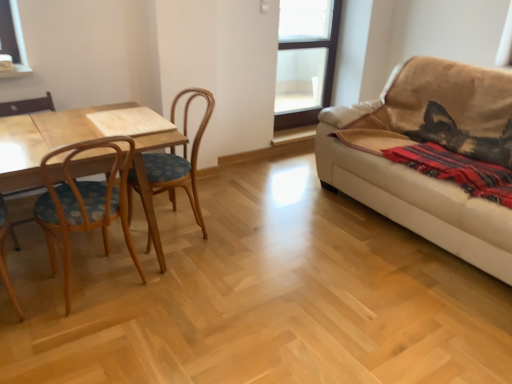
Question: Does beige fabric couch at right have a greater width compared to red woven blanket at right?

Choices:
 (A) no
 (B) yes

Answer: (B)

Question: Can you confirm if beige fabric couch at right is taller than red woven blanket at right?

Choices:
 (A) no
 (B) yes

Answer: (B)

Question: Is beige fabric couch at right not near red woven blanket at right?

Choices:
 (A) yes
 (B) no

Answer: (B)

Question: Is red woven blanket at right at the back of beige fabric couch at right?

Choices:
 (A) yes
 (B) no

Answer: (A)

Question: Is beige fabric couch at right to the left of red woven blanket at right from the viewer's perspective?

Choices:
 (A) no
 (B) yes

Answer: (A)

Question: From a real-world perspective, is beige fabric couch at right over red woven blanket at right?

Choices:
 (A) yes
 (B) no

Answer: (B)

Question: Is beige fabric couch at right at the left side of wooden table at left?

Choices:
 (A) yes
 (B) no

Answer: (B)

Question: Considering the relative sizes of beige fabric couch at right and wooden table at left in the image provided, is beige fabric couch at right thinner than wooden table at left?

Choices:
 (A) yes
 (B) no

Answer: (B)

Question: Is beige fabric couch at right facing away from wooden table at left?

Choices:
 (A) no
 (B) yes

Answer: (A)

Question: Is the position of beige fabric couch at right less distant than that of wooden table at left?

Choices:
 (A) no
 (B) yes

Answer: (A)

Question: From a real-world perspective, does beige fabric couch at right stand above wooden table at left?

Choices:
 (A) no
 (B) yes

Answer: (B)

Question: From a real-world perspective, does beige fabric couch at right sit lower than wooden table at left?

Choices:
 (A) yes
 (B) no

Answer: (B)

Question: Can you confirm if woodenchair at left is smaller than red woven blanket at right?

Choices:
 (A) no
 (B) yes

Answer: (A)